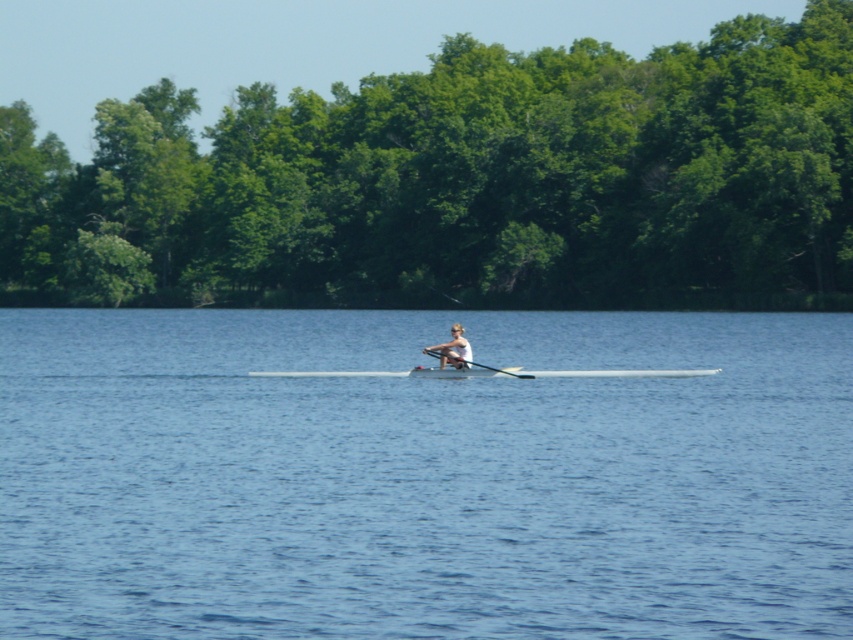
Question: Among these objects, which one is farthest from the camera?

Choices:
 (A) green leafy trees at center
 (B) blue water at center

Answer: (A)

Question: Which point appears closest to the camera in this image?

Choices:
 (A) pos(650,115)
 (B) pos(519,376)

Answer: (B)

Question: Which point appears farthest from the camera in this image?

Choices:
 (A) (471, 362)
 (B) (695, 586)
 (C) (462, 358)

Answer: (A)

Question: Is blue water at center further to the viewer compared to green leafy trees at center?

Choices:
 (A) no
 (B) yes

Answer: (A)

Question: Does green leafy trees at center have a larger size compared to black wood paddle at center?

Choices:
 (A) yes
 (B) no

Answer: (A)

Question: Is light brown wooden paddle at center above black wood paddle at center?

Choices:
 (A) yes
 (B) no

Answer: (A)